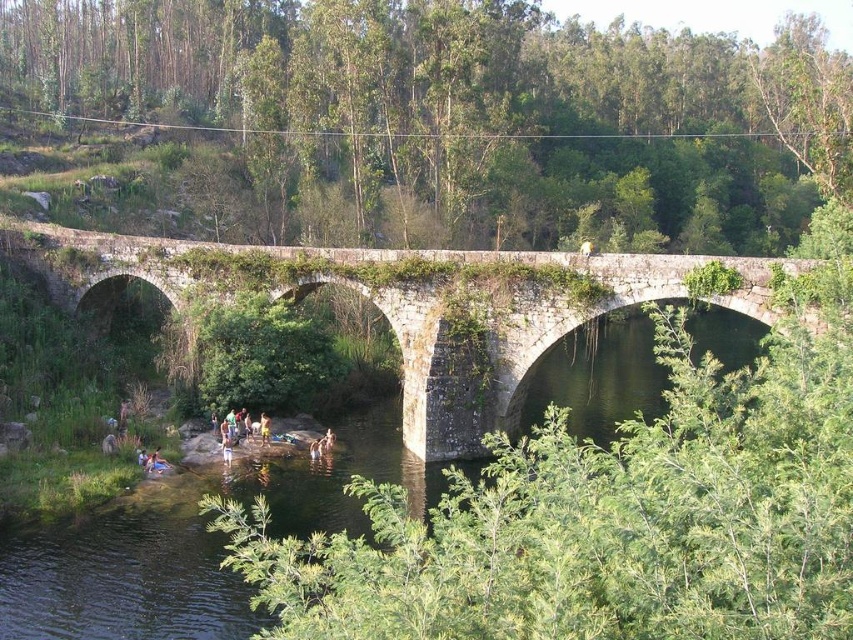
Question: Which object appears farthest from the camera in this image?

Choices:
 (A) light brown wooden stick at lower center
 (B) yellow fabric shorts at lower center

Answer: (B)

Question: Does stone bridge at center appear over yellow fabric shorts at lower center?

Choices:
 (A) no
 (B) yes

Answer: (B)

Question: Is stone bridge at center to the left of light brown wooden stick at lower center from the viewer's perspective?

Choices:
 (A) yes
 (B) no

Answer: (B)

Question: Which point is farther from the camera taking this photo?

Choices:
 (A) (227, 449)
 (B) (267, 440)
 (C) (270, 257)

Answer: (C)

Question: Can you confirm if stone bridge at center is thinner than yellow fabric shorts at lower center?

Choices:
 (A) yes
 (B) no

Answer: (B)

Question: Based on their relative distances, which object is nearer to the light brown wooden stick at lower center?

Choices:
 (A) stone bridge at center
 (B) yellow fabric shorts at lower center

Answer: (B)